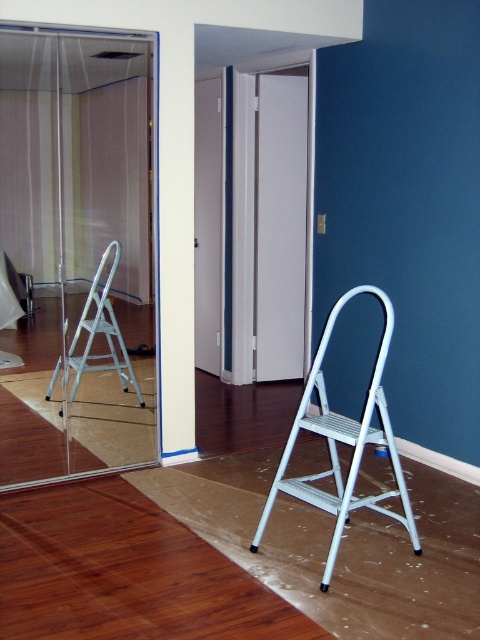
Does transparent glass door at upper left have a lesser width compared to white metallic step stool at center?

Indeed, transparent glass door at upper left has a lesser width compared to white metallic step stool at center.

Between point (122, 163) and point (323, 410), which one is positioned in front?

Positioned in front is point (323, 410).

Where is `transparent glass door at upper left`? transparent glass door at upper left is located at coordinates (76, 253).

Between white matte screen door at center and white metallic step stool at center, which one appears on the left side from the viewer's perspective?

From the viewer's perspective, white matte screen door at center appears more on the left side.

Between white matte screen door at center and white metallic step stool at center, which one appears on the right side from the viewer's perspective?

white metallic step stool at center is more to the right.

Between point (262, 362) and point (384, 298), which one is positioned in front?

Point (384, 298) is in front.

Find the location of `white matte screen door at center`. white matte screen door at center is located at coordinates (280, 225).

Who is more forward, (360, 426) or (61, 356)?

Point (360, 426) is in front.

Which of these two, white metallic step stool at center or silver metallic step ladder at left, stands shorter?

With less height is silver metallic step ladder at left.

Is point (369, 502) positioned behind point (104, 266)?

That is False.

Locate an element on the screen. The height and width of the screenshot is (640, 480). white metallic step stool at center is located at coordinates (343, 442).